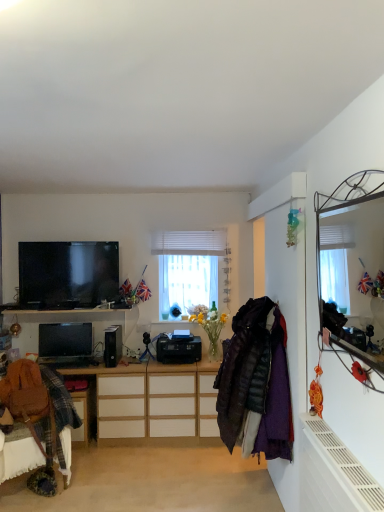
Question: Is black plastic speaker at center taller than white textured blinds at center?

Choices:
 (A) no
 (B) yes

Answer: (A)

Question: Is black plastic speaker at center with white textured blinds at center?

Choices:
 (A) no
 (B) yes

Answer: (A)

Question: Does black plastic speaker at center have a lesser width compared to white textured blinds at center?

Choices:
 (A) yes
 (B) no

Answer: (B)

Question: Does black plastic speaker at center appear on the right side of white textured blinds at center?

Choices:
 (A) no
 (B) yes

Answer: (A)

Question: Is black plastic speaker at center positioned behind white textured blinds at center?

Choices:
 (A) no
 (B) yes

Answer: (A)

Question: From the image's perspective, relative to wooden cabinet at center, is white matte radiator at lower right above or below?

Choices:
 (A) below
 (B) above

Answer: (A)

Question: Based on their sizes in the image, would you say white matte radiator at lower right is bigger or smaller than wooden cabinet at center?

Choices:
 (A) big
 (B) small

Answer: (B)

Question: Based on their positions, is white matte radiator at lower right located to the left or right of wooden cabinet at center?

Choices:
 (A) right
 (B) left

Answer: (A)

Question: Considering the positions of white matte radiator at lower right and wooden cabinet at center in the image, is white matte radiator at lower right wider or thinner than wooden cabinet at center?

Choices:
 (A) wide
 (B) thin

Answer: (B)

Question: Considering the positions of metallic mirror at upper right and brown leather swivel chair at lower left in the image, is metallic mirror at upper right bigger or smaller than brown leather swivel chair at lower left?

Choices:
 (A) small
 (B) big

Answer: (A)

Question: Is metallic mirror at upper right taller or shorter than brown leather swivel chair at lower left?

Choices:
 (A) tall
 (B) short

Answer: (A)

Question: Is metallic mirror at upper right spatially inside brown leather swivel chair at lower left, or outside of it?

Choices:
 (A) inside
 (B) outside

Answer: (B)

Question: Is metallic mirror at upper right in front of or behind brown leather swivel chair at lower left in the image?

Choices:
 (A) behind
 (B) front

Answer: (B)

Question: In terms of width, does white textured blinds at center look wider or thinner when compared to matte black tv at upper left?

Choices:
 (A) wide
 (B) thin

Answer: (B)

Question: Relative to matte black tv at upper left, is white textured blinds at center in front or behind?

Choices:
 (A) behind
 (B) front

Answer: (A)